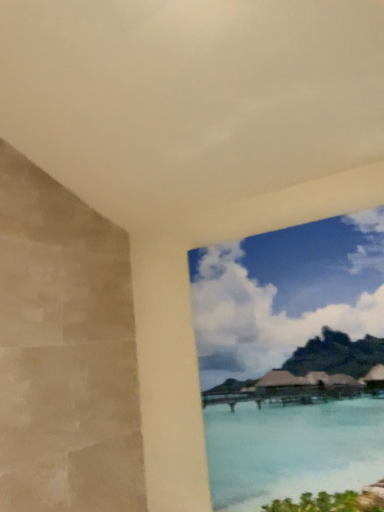
In order to face matte canvas painting of tropical scene at upper right, should I rotate leftwards or rightwards?

A 13.461 degree turn to the right will do.

What do you see at coordinates (291, 301) in the screenshot? I see `matte canvas painting of tropical scene at upper right` at bounding box center [291, 301].

Identify the location of matte canvas painting of tropical scene at upper right. (291, 301).

The image size is (384, 512). Identify the location of matte canvas painting of tropical scene at upper right. (291, 301).